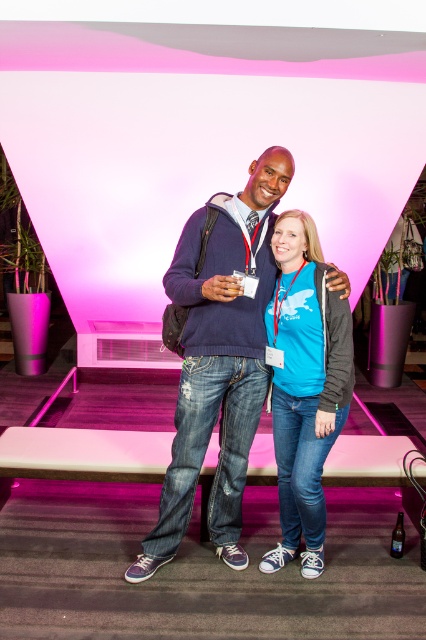
Question: Which of the following is the farthest from the observer?

Choices:
 (A) (299, 304)
 (B) (268, 240)

Answer: (B)

Question: Is the position of denim jeans at center less distant than that of blue cotton t-shirt at center?

Choices:
 (A) yes
 (B) no

Answer: (A)

Question: Is denim jeans at center bigger than blue cotton t-shirt at center?

Choices:
 (A) no
 (B) yes

Answer: (B)

Question: Which point is closer to the camera taking this photo?

Choices:
 (A) (273, 308)
 (B) (241, 204)

Answer: (B)

Question: Can you confirm if denim jeans at center is bigger than blue cotton t-shirt at center?

Choices:
 (A) yes
 (B) no

Answer: (A)

Question: Which object appears farthest from the camera in this image?

Choices:
 (A) blue cotton t-shirt at center
 (B) denim jeans at center

Answer: (A)